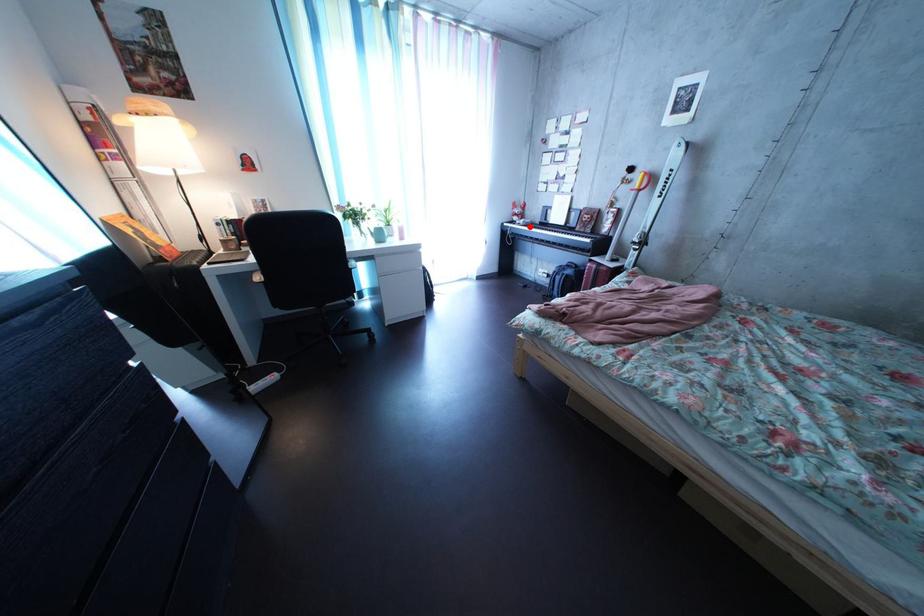
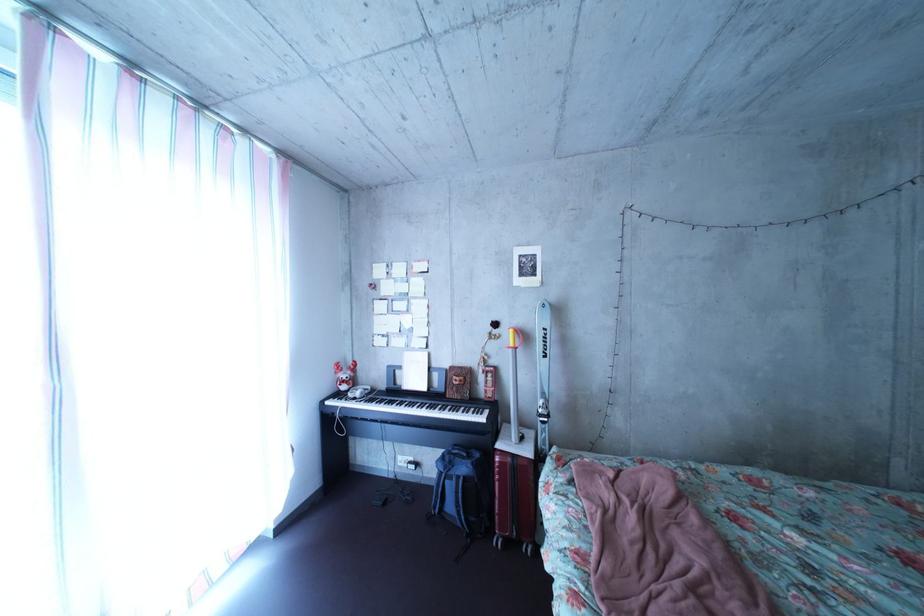
In the second image, find the point that corresponds to the highlighted location in the first image.

(358, 395)